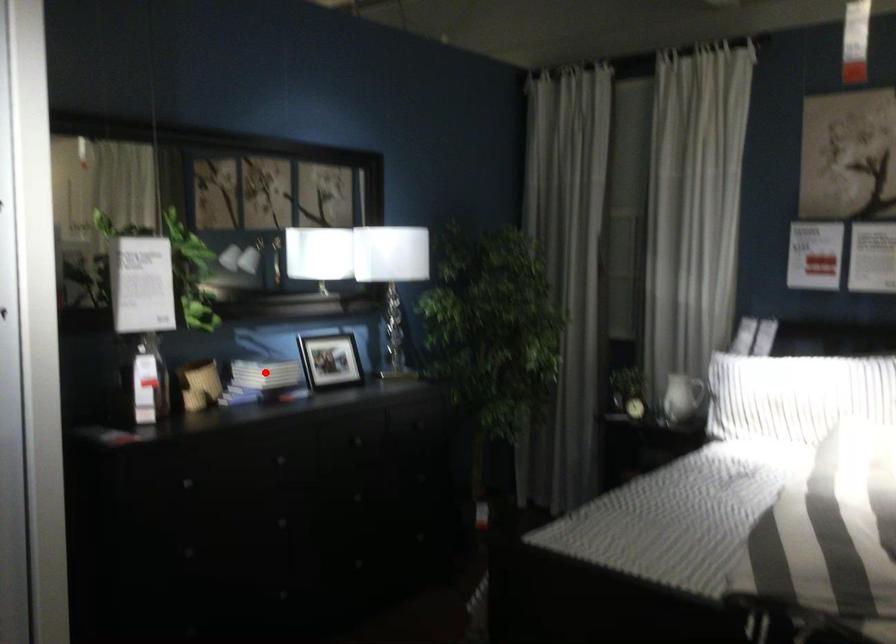
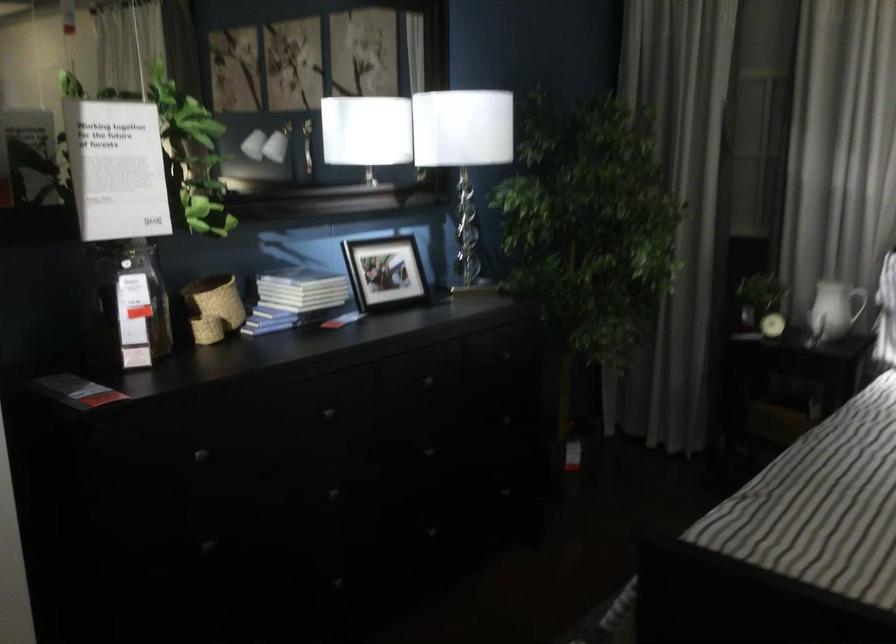
In the second image, find the point that corresponds to the highlighted location in the first image.

(300, 290)